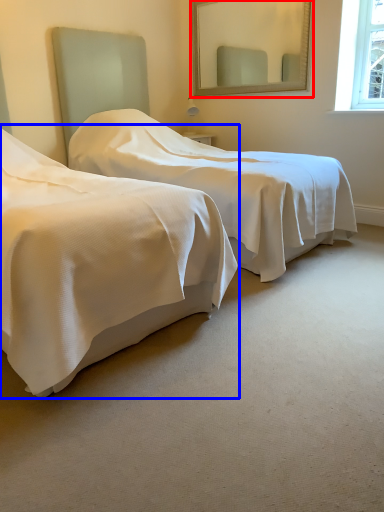
Question: Which object appears closest to the camera in this image, mirror (highlighted by a red box) or bed (highlighted by a blue box)?

Choices:
 (A) mirror
 (B) bed

Answer: (B)